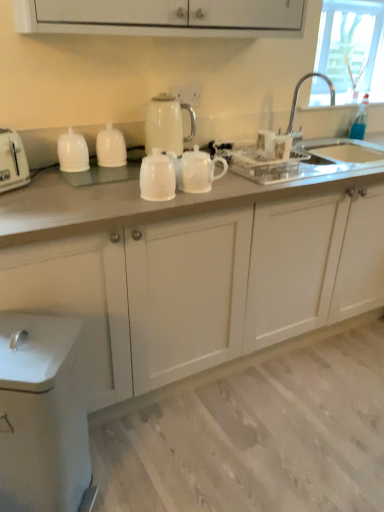
Question: Should I look upward or downward to see silver metallic faucet at upper right?

Choices:
 (A) up
 (B) down

Answer: (A)

Question: Is white matte teapot at center, the 3th tableware positioned from the left, behind white glossy teapot at center?

Choices:
 (A) yes
 (B) no

Answer: (B)

Question: Does white matte teapot at center, the first tableware viewed from the right, appear on the left side of white glossy teapot at center?

Choices:
 (A) yes
 (B) no

Answer: (A)

Question: Is white matte teapot at center, the first tableware viewed from the right, directly adjacent to white glossy teapot at center?

Choices:
 (A) no
 (B) yes

Answer: (B)

Question: Considering the relative sizes of white matte teapot at center, the 3th tableware positioned from the left, and white glossy teapot at center in the image provided, is white matte teapot at center, the 3th tableware positioned from the left, wider than white glossy teapot at center?

Choices:
 (A) no
 (B) yes

Answer: (B)

Question: Is white matte teapot at center, the first tableware viewed from the right, to the right of white glossy teapot at center from the viewer's perspective?

Choices:
 (A) no
 (B) yes

Answer: (A)

Question: Is white matte teapot at center, the 3th tableware positioned from the left, shorter than white glossy teapot at center?

Choices:
 (A) yes
 (B) no

Answer: (B)

Question: Can you confirm if white glossy cups at center, which is the 3th tableware in right-to-left order, is shorter than white glossy teapot at center, the 2th tableware positioned from the left?

Choices:
 (A) yes
 (B) no

Answer: (A)

Question: Does white glossy cups at center, which is the 3th tableware in right-to-left order, have a larger size compared to white glossy teapot at center, the 2th tableware positioned from the left?

Choices:
 (A) no
 (B) yes

Answer: (B)

Question: From the image's perspective, would you say white glossy cups at center, the first tableware from the left, is shown under white glossy teapot at center, which is the 2th tableware from right to left?

Choices:
 (A) no
 (B) yes

Answer: (B)

Question: Is white glossy cups at center, the first tableware from the left, wider than white glossy teapot at center, which is the 2th tableware from right to left?

Choices:
 (A) yes
 (B) no

Answer: (A)

Question: Is white glossy cups at center, the first tableware from the left, not within white glossy teapot at center, which is the 2th tableware from right to left?

Choices:
 (A) yes
 (B) no

Answer: (A)

Question: Considering the relative sizes of white glossy cups at center, which is the 3th tableware in right-to-left order, and white glossy teapot at center, the 2th tableware positioned from the left, in the image provided, is white glossy cups at center, which is the 3th tableware in right-to-left order, taller than white glossy teapot at center, the 2th tableware positioned from the left,?

Choices:
 (A) yes
 (B) no

Answer: (B)

Question: From a real-world perspective, is silver metallic faucet at upper right positioned under white glossy electric kettle at upper center based on gravity?

Choices:
 (A) no
 (B) yes

Answer: (A)